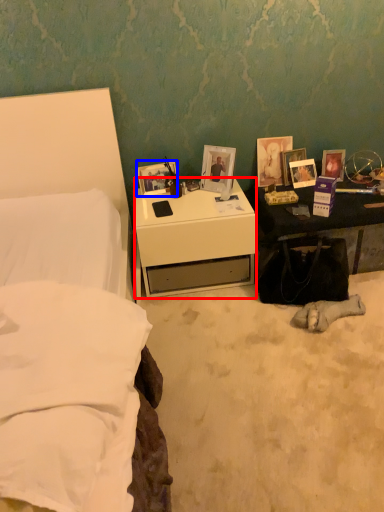
Question: Which of the following is the closest to the observer, desk (highlighted by a red box) or picture frame (highlighted by a blue box)?

Choices:
 (A) desk
 (B) picture frame

Answer: (A)